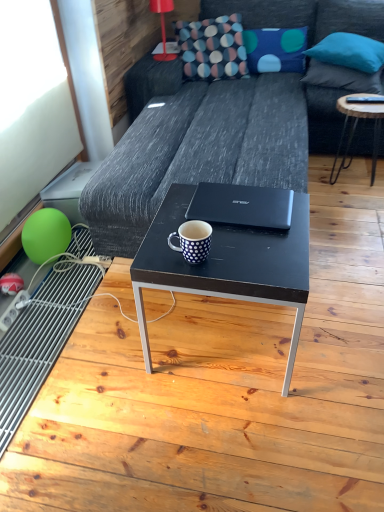
Question: Looking at their shapes, would you say green rubber balloon at lower left is wider or thinner than dark gray fabric couch at center?

Choices:
 (A) thin
 (B) wide

Answer: (A)

Question: From their relative heights in the image, would you say green rubber balloon at lower left is taller or shorter than dark gray fabric couch at center?

Choices:
 (A) tall
 (B) short

Answer: (B)

Question: Estimate the real-world distances between objects in this image. Which object is farther from the red plastic lamp at upper center?

Choices:
 (A) blue fabric pillow at upper right, the 3th pillow in the left-to-right sequence
 (B) white dotted mug at center
 (C) dark gray fabric couch at center
 (D) black matte laptop at center
 (E) green rubber balloon at lower left

Answer: (B)

Question: Based on their relative distances, which object is farther from the dark gray fabric couch at center?

Choices:
 (A) textured multicolored pillow at upper center
 (B) blue fabric pillow at upper right, the first pillow positioned from the right
 (C) black matte laptop at center
 (D) black matte coffee table at center
 (E) wooden round table at right

Answer: (D)